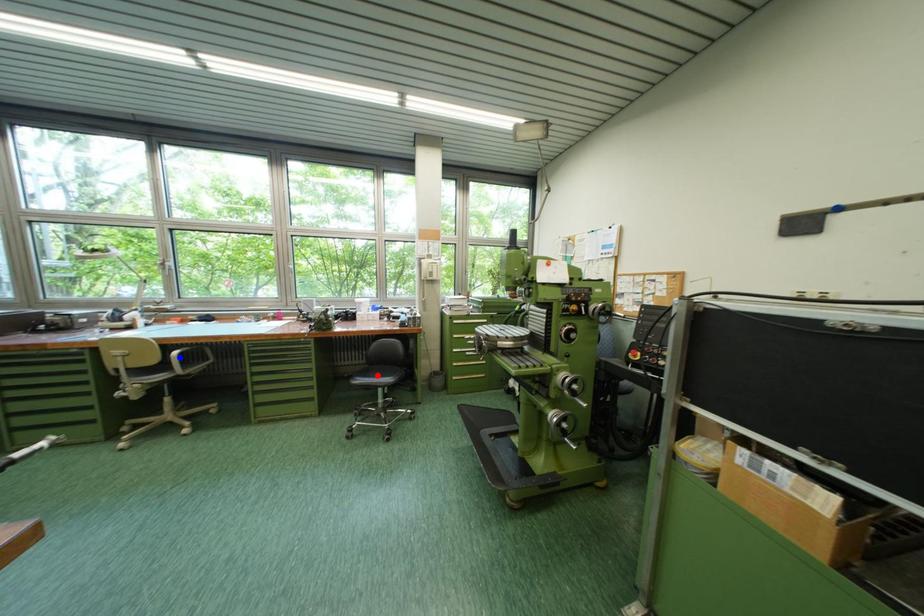
Question: Which of the two points in the image is closer to the camera?

Choices:
 (A) Blue point is closer.
 (B) Red point is closer.

Answer: (A)